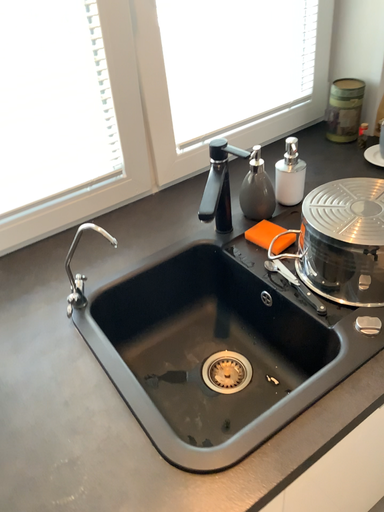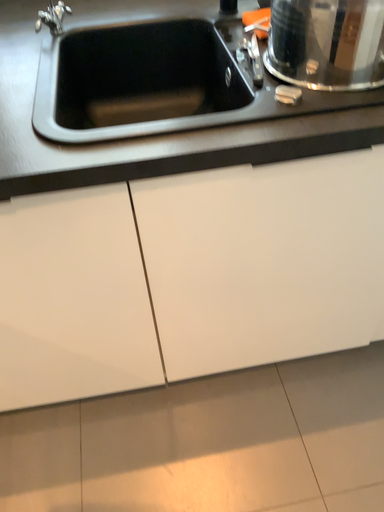
Question: Which way did the camera rotate in the video?

Choices:
 (A) rotated right
 (B) rotated left

Answer: (B)